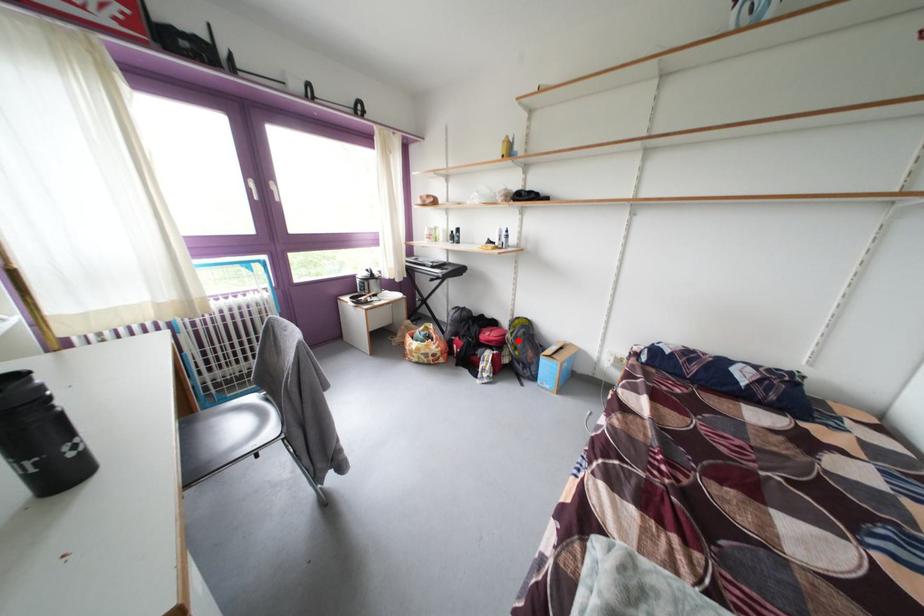
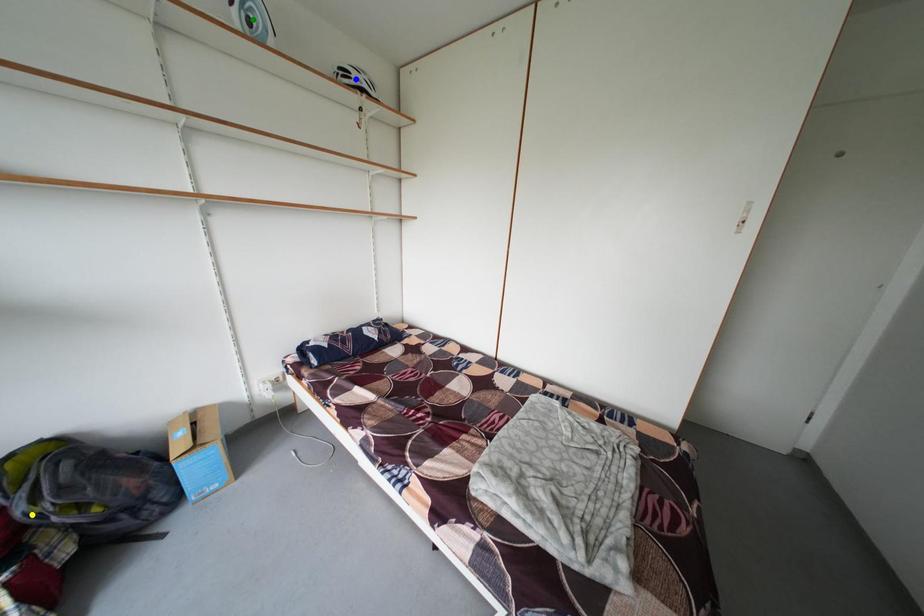
Question: I am providing you with two images of the same scene from different viewpoints. A red point is marked on the first image. You are given multiple points on the second image. Which mark in image 2 goes with the point in image 1?

Choices:
 (A) yellow point
 (B) blue point
 (C) green point

Answer: (A)